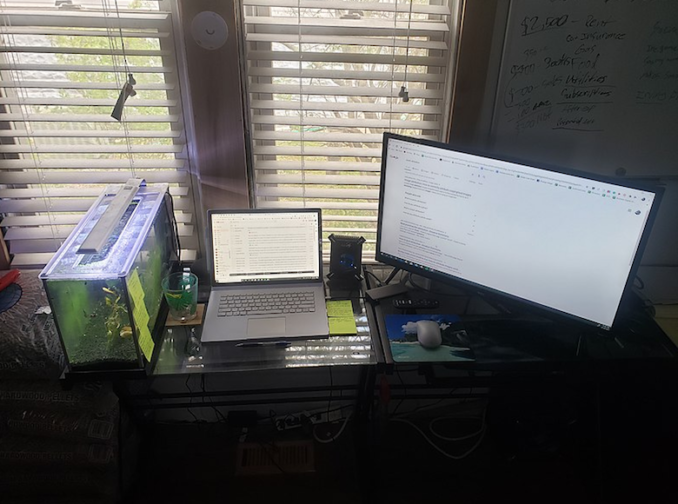
At what (x,y) coordinates should I click in order to perform the action: click on desk. Please return your answer as a coordinate pair (x, y). The width and height of the screenshot is (678, 504). Looking at the image, I should click on (356, 349), (458, 302).